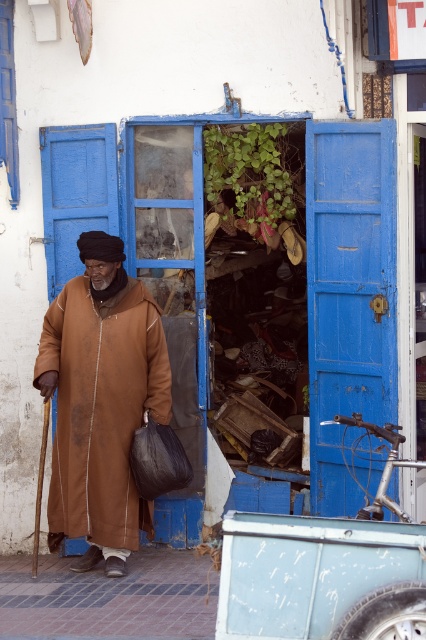
Question: Which object is farther from the camera taking this photo?

Choices:
 (A) brown matte robe at center
 (B) blue wooden door at right

Answer: (B)

Question: Among these objects, which one is nearest to the camera?

Choices:
 (A) brown matte robe at center
 (B) blue wooden door at right

Answer: (A)

Question: Can you confirm if blue wooden door at right is smaller than brown matte robe at center?

Choices:
 (A) no
 (B) yes

Answer: (A)

Question: Is blue wooden door at right to the left of brown matte robe at center from the viewer's perspective?

Choices:
 (A) no
 (B) yes

Answer: (A)

Question: Is blue wooden door at right positioned behind brown matte robe at center?

Choices:
 (A) yes
 (B) no

Answer: (A)

Question: Which of the following is the closest to the observer?

Choices:
 (A) blue wooden door at right
 (B) brown matte robe at center

Answer: (B)